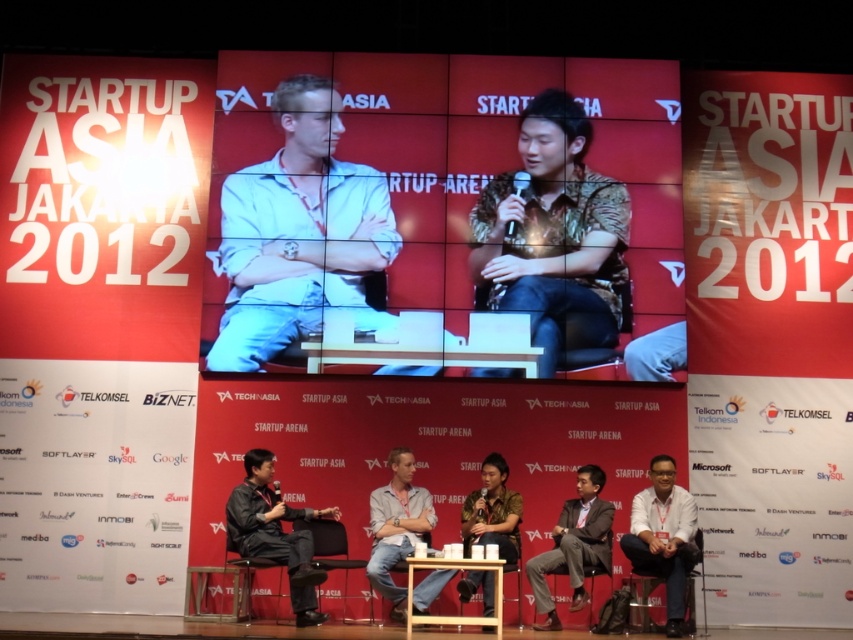
You are organizing a panel discussion and need to seat two speakers. The first speaker prefers a larger chair. Given the scene described, which chair between the matte black chair at lower right and the black leather chair at lower left should you choose?

The matte black chair at lower right is bigger than the black leather chair at lower left, so you should choose the matte black chair at lower right for the speaker who prefers a larger chair.

You are a photographer at the event and want to capture a photo where both the white matte shirt at lower right and the camouflage fabric shirt at center are clearly visible. Given their heights, which shirt should you adjust the camera angle to focus on to ensure both are in frame?

The white matte shirt at lower right is much taller than the camouflage fabric shirt at center, so you should position the camera angle slightly lower to capture the taller white matte shirt at lower right while still keeping the shorter camouflage fabric shirt at center in view.